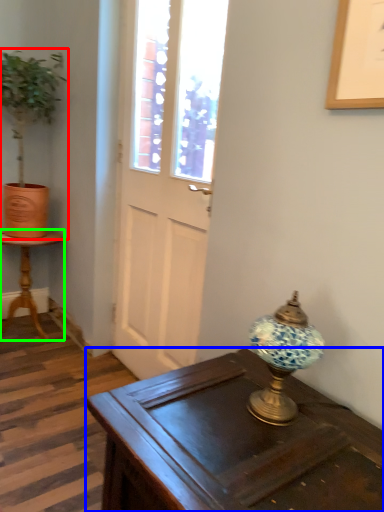
Question: Considering the real-world distances, which object is farthest from houseplant (highlighted by a red box)? desk (highlighted by a blue box) or table (highlighted by a green box)?

Choices:
 (A) desk
 (B) table

Answer: (A)